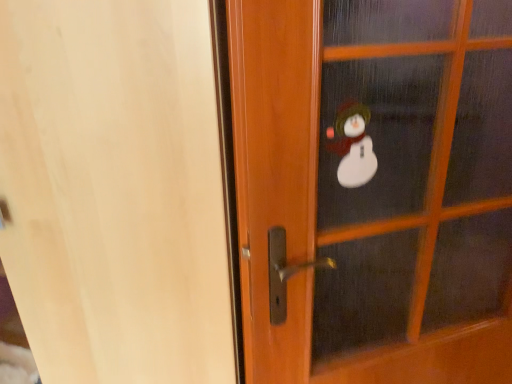
Question: Is wooden screen door at center, which ranks as the 1th screen door in right-to-left order, wider or thinner than transparent glass snowman at upper right, which is counted as the 2th screen door, starting from the right?

Choices:
 (A) thin
 (B) wide

Answer: (A)

Question: From a real-world perspective, is wooden screen door at center, marked as the second screen door in a left-to-right arrangement, physically located above or below transparent glass snowman at upper right, the first screen door from the left?

Choices:
 (A) below
 (B) above

Answer: (B)

Question: Does point (457, 238) appear closer or farther from the camera than point (24, 225)?

Choices:
 (A) closer
 (B) farther

Answer: (B)

Question: In the image, is transparent glass snowman at upper right, the first screen door from the left, on the left side or the right side of wooden screen door at center, marked as the second screen door in a left-to-right arrangement?

Choices:
 (A) left
 (B) right

Answer: (A)

Question: From a real-world perspective, is transparent glass snowman at upper right, the first screen door from the left, physically located above or below wooden screen door at center, marked as the second screen door in a left-to-right arrangement?

Choices:
 (A) above
 (B) below

Answer: (B)

Question: In terms of width, does transparent glass snowman at upper right, the first screen door from the left, look wider or thinner when compared to wooden screen door at center, marked as the second screen door in a left-to-right arrangement?

Choices:
 (A) thin
 (B) wide

Answer: (B)

Question: From their relative heights in the image, would you say transparent glass snowman at upper right, the first screen door from the left, is taller or shorter than wooden screen door at center, marked as the second screen door in a left-to-right arrangement?

Choices:
 (A) tall
 (B) short

Answer: (A)